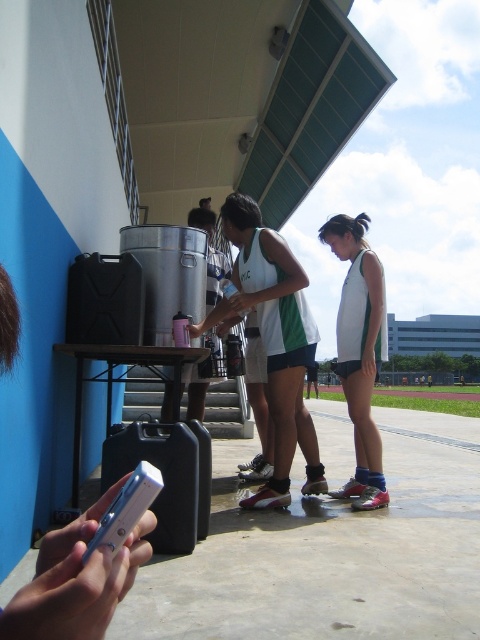
Measure the distance between point (382, 314) and camera.

Point (382, 314) is 3.93 meters away from camera.

Is white matte tank top at center smaller than black plastic suitcase at lower left?

Actually, white matte tank top at center might be larger than black plastic suitcase at lower left.

What do you see at coordinates (360, 352) in the screenshot? I see `white matte tank top at center` at bounding box center [360, 352].

Find the location of a particular element. white matte tank top at center is located at coordinates (360, 352).

Which is in front, point (364, 260) or point (115, 497)?

Point (115, 497)

How distant is white matte tank top at center from silver metallic smartphone at lower left?

white matte tank top at center is 3.46 meters away from silver metallic smartphone at lower left.

Identify the location of white matte tank top at center. (360, 352).

Does black plastic suitcase at lower left appear over silver metallic smartphone at lower left?

No.

Is black plastic suitcase at lower left further to the viewer compared to silver metallic smartphone at lower left?

Yes, black plastic suitcase at lower left is further from the viewer.

Locate an element on the screen. black plastic suitcase at lower left is located at coordinates (167, 477).

Locate an element on the screen. This screenshot has width=480, height=640. black plastic suitcase at lower left is located at coordinates (167, 477).